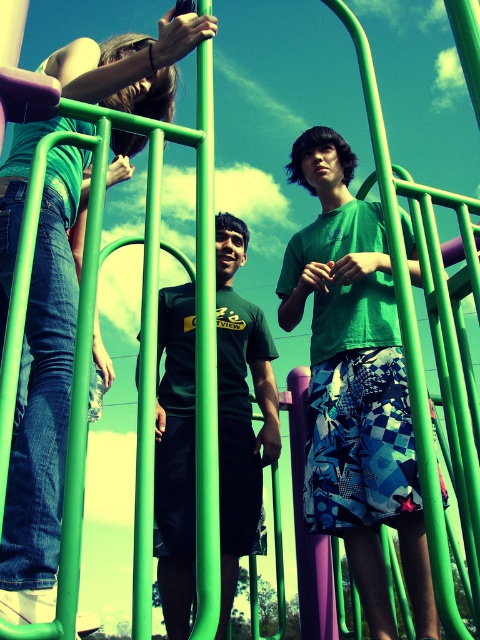
Question: Which is farther from the black matte t-shirt at center?

Choices:
 (A) green matte shirt at upper center
 (B) green matte shirt at center

Answer: (A)

Question: Is green matte shirt at upper center behind black matte t-shirt at center?

Choices:
 (A) no
 (B) yes

Answer: (A)

Question: Which object appears closest to the camera in this image?

Choices:
 (A) black matte t-shirt at center
 (B) green matte shirt at upper center

Answer: (B)

Question: Is green matte shirt at center wider than green matte shirt at upper center?

Choices:
 (A) yes
 (B) no

Answer: (B)

Question: Which point appears farthest from the camera in this image?

Choices:
 (A) (6, 577)
 (B) (247, 483)

Answer: (B)

Question: Does green matte shirt at center appear on the right side of green matte shirt at upper center?

Choices:
 (A) no
 (B) yes

Answer: (B)